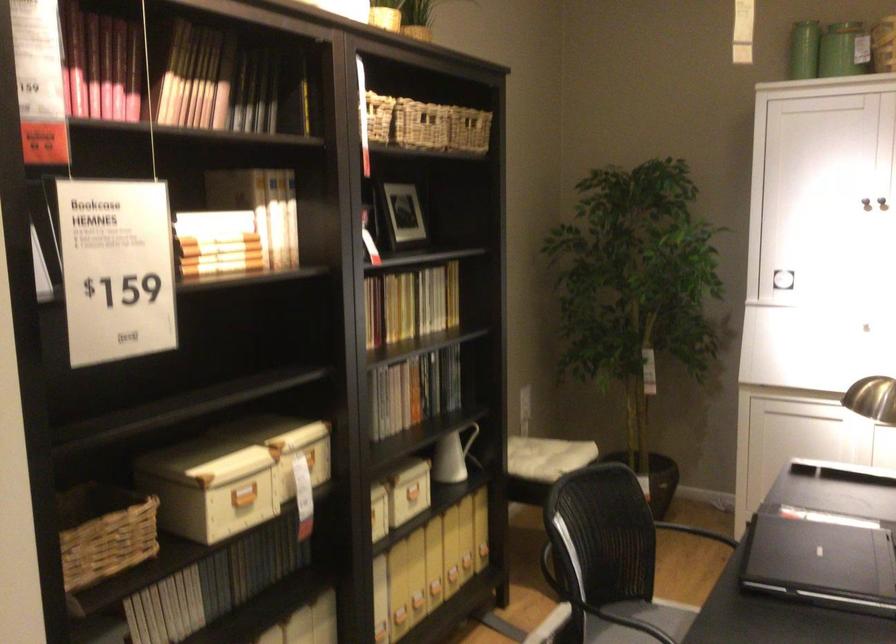
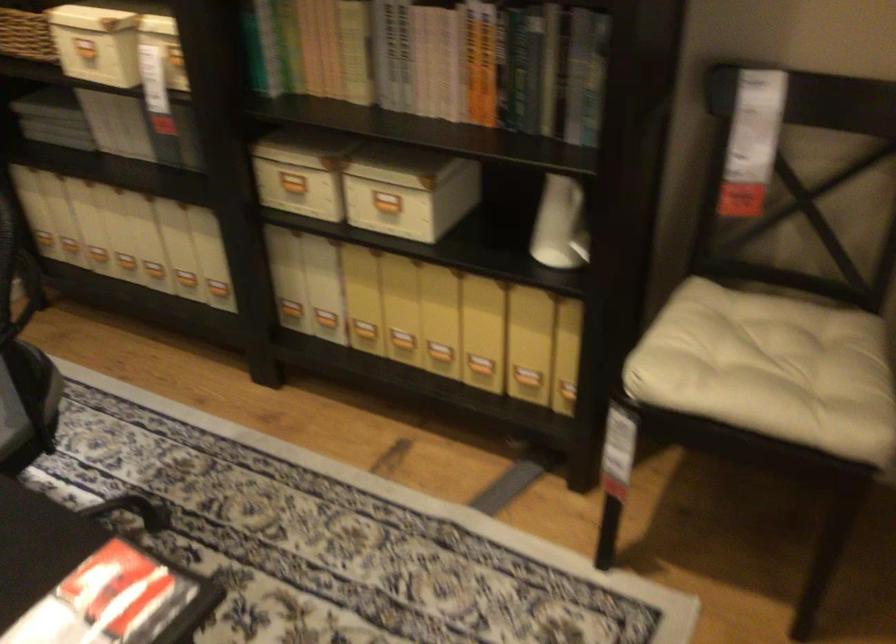
Where in the second image is the point corresponding to [294,442] from the first image?

(268, 46)